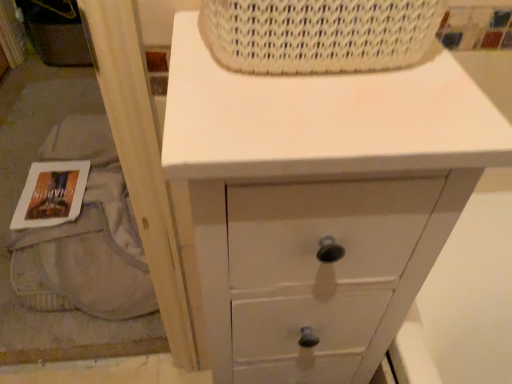
Question: From a real-world perspective, is white woven basket at upper center positioned over white painted wood chest of drawers at upper center based on gravity?

Choices:
 (A) yes
 (B) no

Answer: (A)

Question: From the image's perspective, is white woven basket at upper center under white painted wood chest of drawers at upper center?

Choices:
 (A) no
 (B) yes

Answer: (A)

Question: Is white woven basket at upper center positioned with its back to white painted wood chest of drawers at upper center?

Choices:
 (A) yes
 (B) no

Answer: (B)

Question: Is white woven basket at upper center thinner than white painted wood chest of drawers at upper center?

Choices:
 (A) no
 (B) yes

Answer: (B)

Question: Can you confirm if white woven basket at upper center is positioned to the right of white painted wood chest of drawers at upper center?

Choices:
 (A) yes
 (B) no

Answer: (A)

Question: Is white woven basket at upper center not inside white painted wood chest of drawers at upper center?

Choices:
 (A) yes
 (B) no

Answer: (A)

Question: Is white painted wood chest of drawers at upper center positioned with its back to white woven basket at upper center?

Choices:
 (A) no
 (B) yes

Answer: (A)

Question: Is white painted wood chest of drawers at upper center positioned far away from white woven basket at upper center?

Choices:
 (A) yes
 (B) no

Answer: (B)

Question: Does white painted wood chest of drawers at upper center have a lesser width compared to white woven basket at upper center?

Choices:
 (A) yes
 (B) no

Answer: (B)

Question: From the image's perspective, does white painted wood chest of drawers at upper center appear lower than white woven basket at upper center?

Choices:
 (A) yes
 (B) no

Answer: (A)

Question: Could white woven basket at upper center be considered to be inside white painted wood chest of drawers at upper center?

Choices:
 (A) yes
 (B) no

Answer: (B)

Question: Is white painted wood chest of drawers at upper center wider than white woven basket at upper center?

Choices:
 (A) yes
 (B) no

Answer: (A)

Question: Can you confirm if white paper book at lower left is shorter than white painted wood chest of drawers at upper center?

Choices:
 (A) no
 (B) yes

Answer: (B)